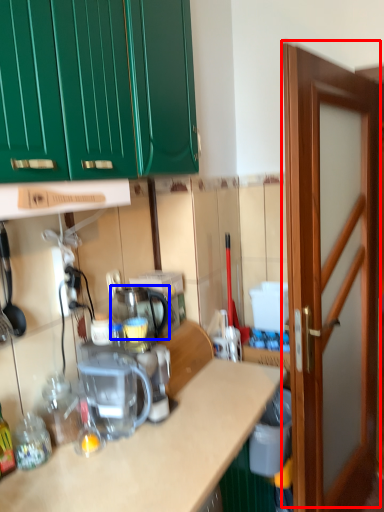
Question: Among these objects, which one is farthest to the camera, door (highlighted by a red box) or appliance (highlighted by a blue box)?

Choices:
 (A) door
 (B) appliance

Answer: (B)